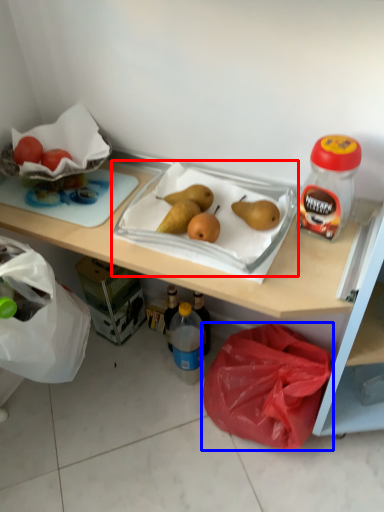
Question: Among these objects, which one is nearest to the camera, wide (highlighted by a red box) or plastic bag (highlighted by a blue box)?

Choices:
 (A) wide
 (B) plastic bag

Answer: (A)